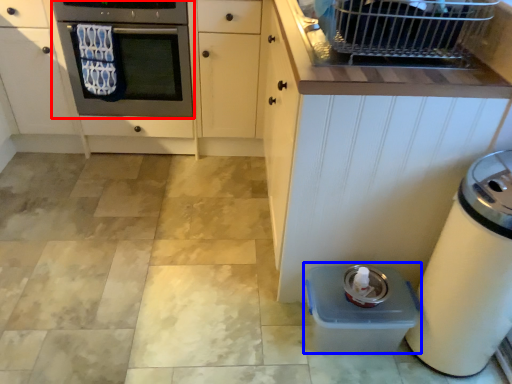
Question: Which point is closer to the camera, oven (highlighted by a red box) or water cooler (highlighted by a blue box)?

Choices:
 (A) oven
 (B) water cooler

Answer: (B)